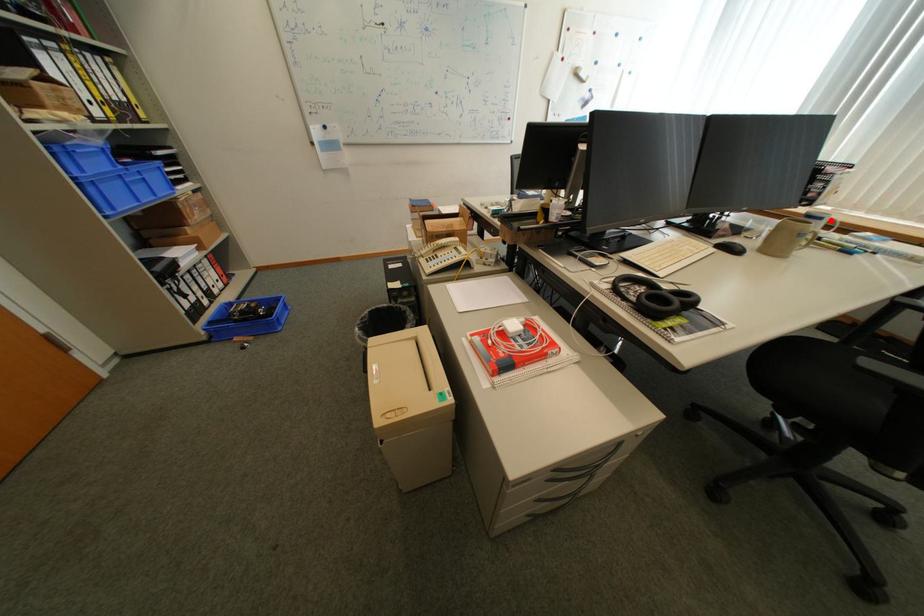
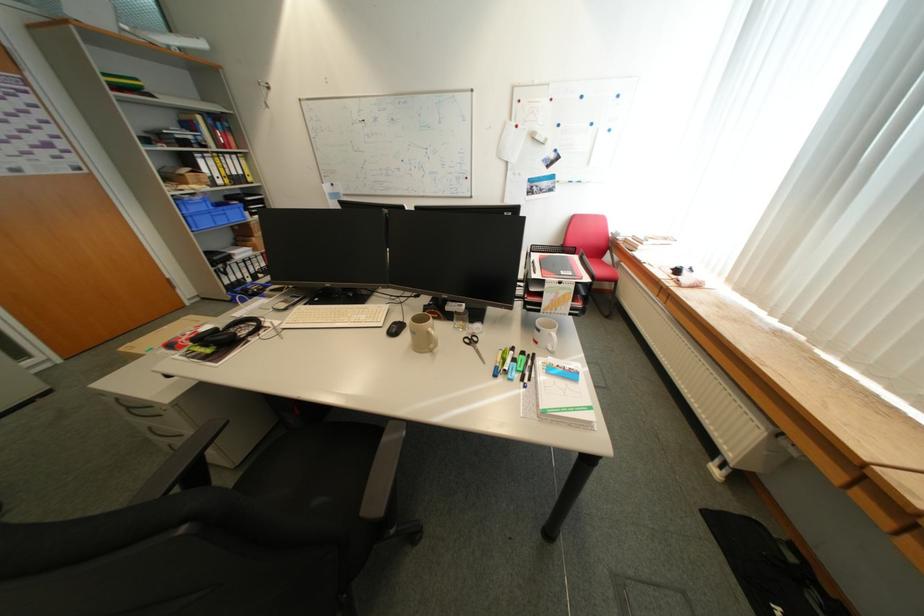
Locate, in the second image, the point that corresponds to the highlighted location in the first image.

(548, 331)